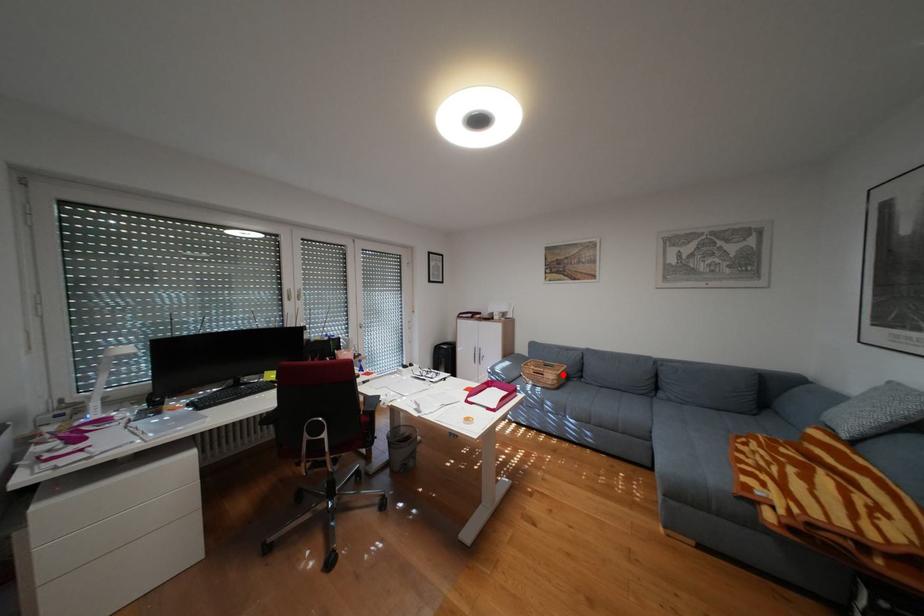
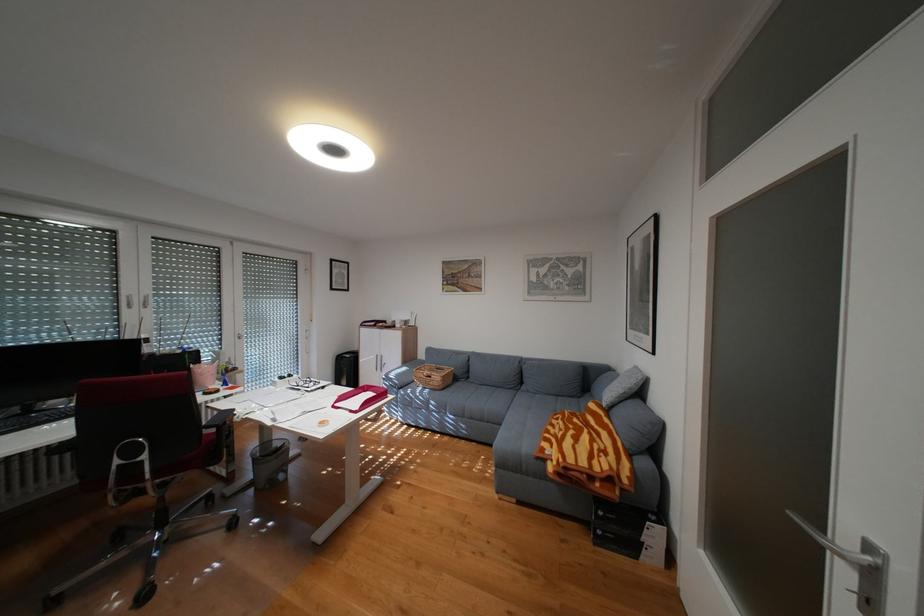
Find the pixel in the second image that matches the highlighted location in the first image.

(450, 377)